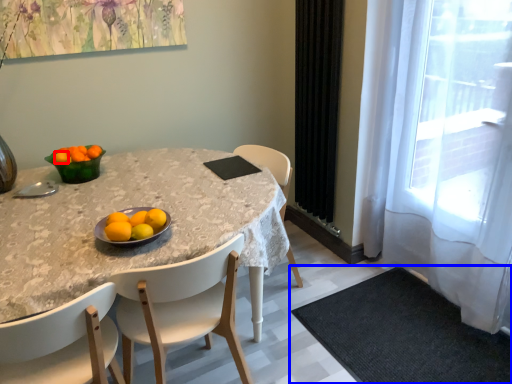
Question: Which point is further to the camera, tangerine (highlighted by a red box) or place mat (highlighted by a blue box)?

Choices:
 (A) tangerine
 (B) place mat

Answer: (A)